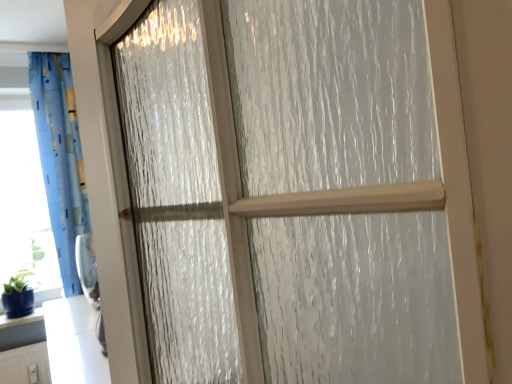
Question: Is transparent plastic window screen at left turned away from blue fabric curtain at left?

Choices:
 (A) no
 (B) yes

Answer: (A)

Question: From a real-world perspective, is transparent plastic window screen at left physically above blue fabric curtain at left?

Choices:
 (A) yes
 (B) no

Answer: (B)

Question: Would you say transparent plastic window screen at left is a long distance from blue fabric curtain at left?

Choices:
 (A) no
 (B) yes

Answer: (A)

Question: Could you tell me if transparent plastic window screen at left is turned towards blue fabric curtain at left?

Choices:
 (A) yes
 (B) no

Answer: (B)

Question: Considering the relative sizes of transparent plastic window screen at left and blue fabric curtain at left in the image provided, is transparent plastic window screen at left taller than blue fabric curtain at left?

Choices:
 (A) no
 (B) yes

Answer: (A)

Question: From the image's perspective, is blue fabric curtain at left above or below blue glossy vase at lower left?

Choices:
 (A) below
 (B) above

Answer: (B)

Question: Considering the positions of blue fabric curtain at left and blue glossy vase at lower left in the image, is blue fabric curtain at left wider or thinner than blue glossy vase at lower left?

Choices:
 (A) thin
 (B) wide

Answer: (B)

Question: Considering their positions, is blue fabric curtain at left located in front of or behind blue glossy vase at lower left?

Choices:
 (A) behind
 (B) front

Answer: (B)

Question: Based on their sizes in the image, would you say blue fabric curtain at left is bigger or smaller than blue glossy vase at lower left?

Choices:
 (A) small
 (B) big

Answer: (B)

Question: Based on their positions, is blue fabric curtain at left located to the left or right of transparent plastic window screen at left?

Choices:
 (A) left
 (B) right

Answer: (B)

Question: Looking at their shapes, would you say blue fabric curtain at left is wider or thinner than transparent plastic window screen at left?

Choices:
 (A) wide
 (B) thin

Answer: (A)

Question: Is point (72, 127) positioned closer to the camera than point (34, 201)?

Choices:
 (A) farther
 (B) closer

Answer: (B)

Question: From a real-world perspective, relative to transparent plastic window screen at left, is blue fabric curtain at left vertically above or below?

Choices:
 (A) above
 (B) below

Answer: (A)

Question: Considering the positions of blue glossy vase at lower left and blue fabric curtain at left in the image, is blue glossy vase at lower left taller or shorter than blue fabric curtain at left?

Choices:
 (A) tall
 (B) short

Answer: (B)

Question: In the image, is blue glossy vase at lower left on the left side or the right side of blue fabric curtain at left?

Choices:
 (A) left
 (B) right

Answer: (A)